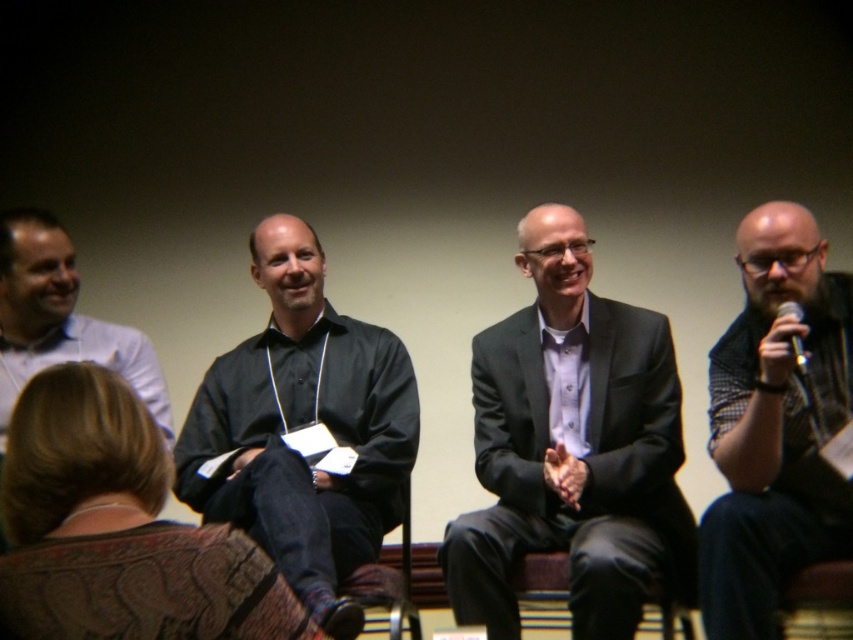
Who is shorter, black matte shirt at center or black textured shirt at right?

Standing shorter between the two is black matte shirt at center.

Is black matte shirt at center above black textured shirt at right?

No.

Between point (271, 227) and point (798, 504), which one is positioned behind?

Positioned behind is point (271, 227).

Where is `black matte shirt at center`? black matte shirt at center is located at coordinates (303, 429).

Who is positioned more to the left, dark gray suit at center or black matte shirt at center?

black matte shirt at center

Find the location of a particular element. Image resolution: width=853 pixels, height=640 pixels. dark gray suit at center is located at coordinates coord(572,448).

Which is below, black textured shirt at right or metallic silver microphone at right?

Positioned lower is black textured shirt at right.

Who is more distant from viewer, (851, 385) or (805, 368)?

The point (851, 385) is more distant.

Image resolution: width=853 pixels, height=640 pixels. I want to click on black textured shirt at right, so click(x=775, y=426).